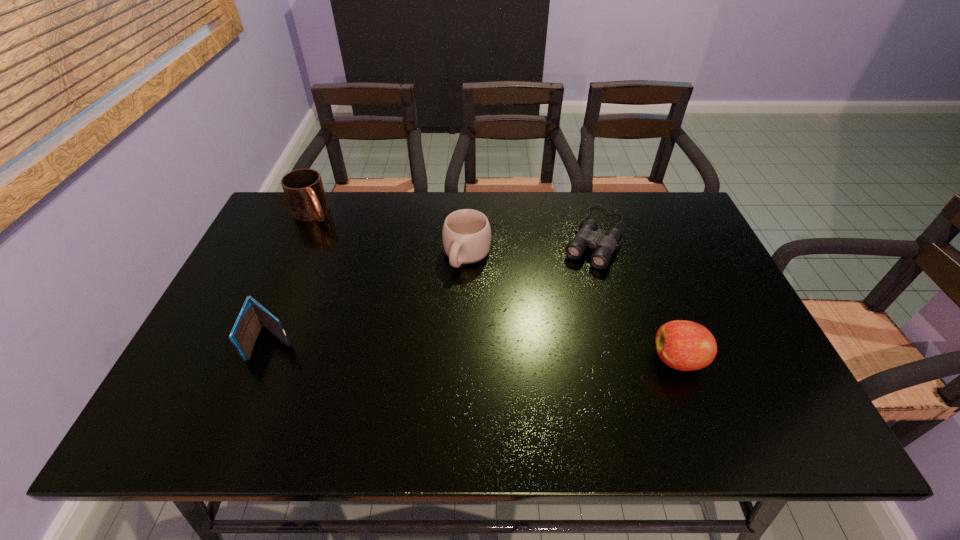
Where is `free space located 0.270m on the side of the farther mug with the handle`? Image resolution: width=960 pixels, height=540 pixels. free space located 0.270m on the side of the farther mug with the handle is located at coordinates (357, 275).

You are a GUI agent. You are given a task and a screenshot of the screen. Output one action in this format:
    pyautogui.click(x=<x>, y=<y>)
    Task: Click on the vacant space located on the side of the third object from right to left with the handle
    Image resolution: width=960 pixels, height=540 pixels.
    Given the screenshot: What is the action you would take?
    pyautogui.click(x=397, y=382)

Image resolution: width=960 pixels, height=540 pixels. Find the location of `vacant point located on the side of the third object from right to left with the handle`. vacant point located on the side of the third object from right to left with the handle is located at coordinates (425, 332).

Image resolution: width=960 pixels, height=540 pixels. In order to click on vacant space located 0.310m on the side of the third object from right to left with the handle in this screenshot , I will do `click(407, 364)`.

Where is `free region located at the eyepiece of the shortest object`? The height and width of the screenshot is (540, 960). free region located at the eyepiece of the shortest object is located at coordinates (547, 328).

Where is `vacant space located at the eyepiece of the shortest object`? The image size is (960, 540). vacant space located at the eyepiece of the shortest object is located at coordinates (528, 361).

Identify the location of free region located 0.350m at the eyepiece of the shortest object. This screenshot has width=960, height=540. (530, 357).

Where is `binoculars located in the far edge section of the desktop`? Image resolution: width=960 pixels, height=540 pixels. binoculars located in the far edge section of the desktop is located at coordinates (588, 236).

Find the location of a particular element. object that is at the near edge is located at coordinates (683, 345).

This screenshot has width=960, height=540. What are the coordinates of `wallet at the left edge` in the screenshot? It's located at (253, 315).